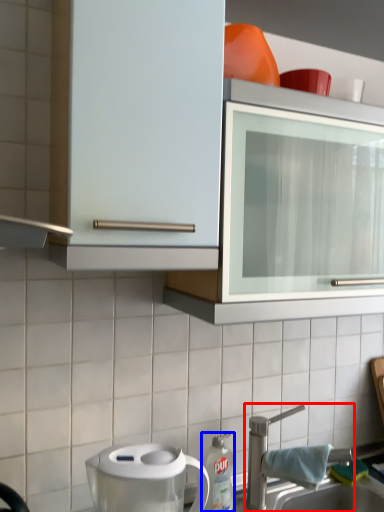
Question: Which object is further to the camera taking this photo, tap (highlighted by a red box) or kitchen appliance (highlighted by a blue box)?

Choices:
 (A) tap
 (B) kitchen appliance

Answer: (B)